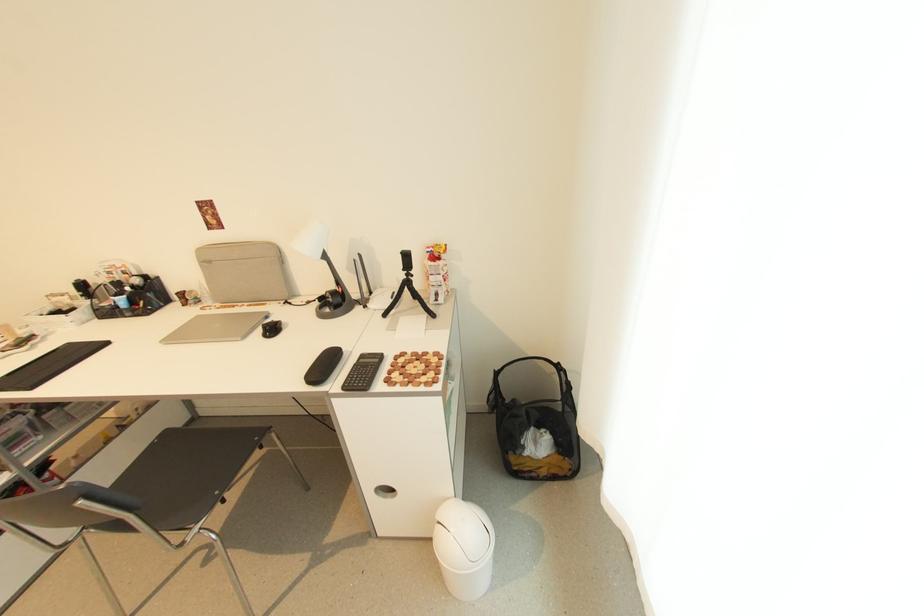
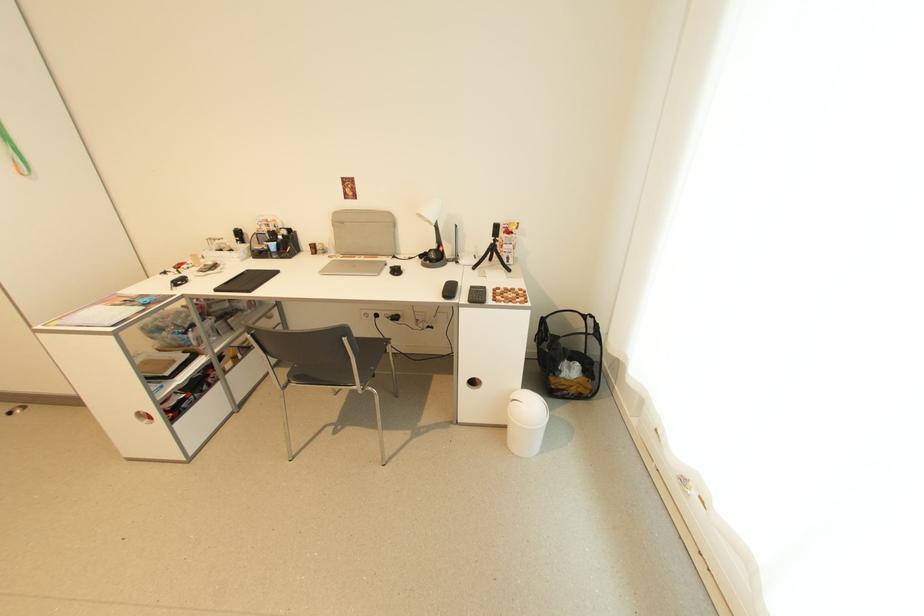
Locate, in the second image, the point that corresponds to point (214, 264) in the first image.

(347, 224)